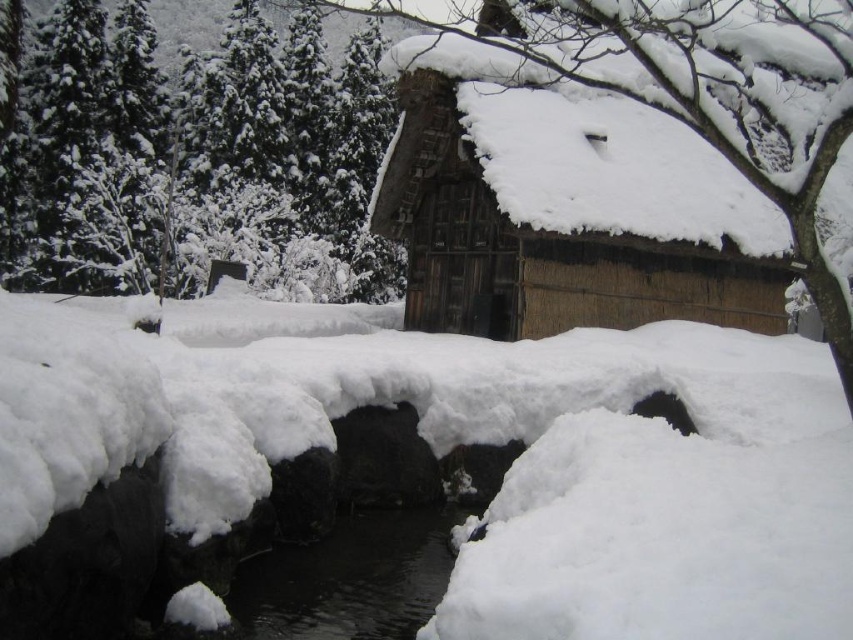
Question: Is thatched wood cabin at center closer to camera compared to black smooth water at center?

Choices:
 (A) yes
 (B) no

Answer: (B)

Question: Which point is farther to the camera?

Choices:
 (A) tap(253, 100)
 (B) tap(508, 202)
 (C) tap(335, 557)

Answer: (A)

Question: Which object is closer to the camera taking this photo?

Choices:
 (A) thatched wood cabin at center
 (B) black smooth water at center
 (C) snow-covered evergreen at upper left

Answer: (B)

Question: Is snow-covered evergreen at upper left thinner than thatched wood cabin at center?

Choices:
 (A) no
 (B) yes

Answer: (A)

Question: Which of the following is the farthest from the observer?

Choices:
 (A) thatched wood cabin at center
 (B) snow-covered evergreen at upper left

Answer: (A)

Question: Does snow-covered evergreen at upper left have a larger size compared to black smooth water at center?

Choices:
 (A) no
 (B) yes

Answer: (B)